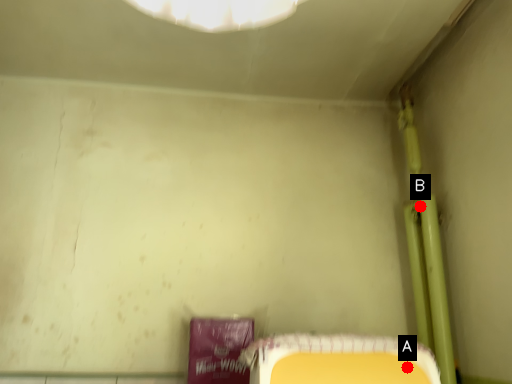
Question: Two points are circled on the image, labeled by A and B beside each circle. Which point is farther to the camera?

Choices:
 (A) A is further
 (B) B is further

Answer: (B)